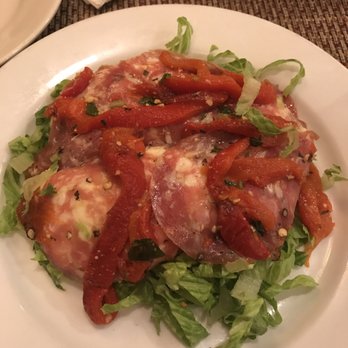
Where is `plate`? This screenshot has height=348, width=348. plate is located at coordinates (121, 332).